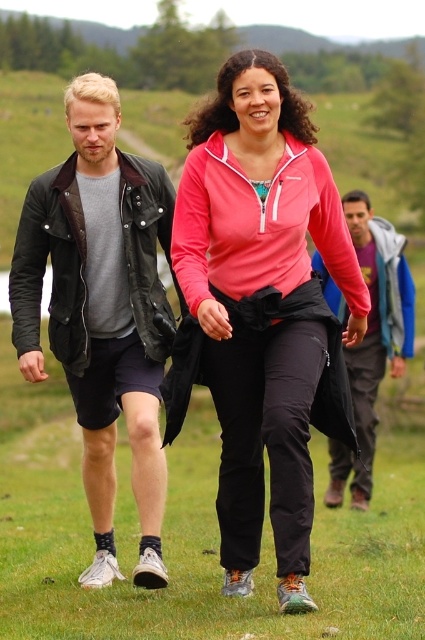
Where is the pink fleece jacket at center located in the image?

The pink fleece jacket at center is located at point (x=266, y=308).

You are a hiker who wants to choose a jacket to wear for the day. You see the pink fleece jacket at center and the blue denim jacket at center. Which one is bigger in size?

The pink fleece jacket at center is larger in size compared to the blue denim jacket at center.